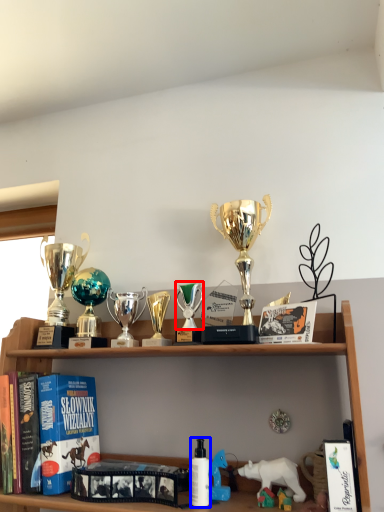
Question: Which object is closer to the camera taking this photo, toy (highlighted by a red box) or toiletry (highlighted by a blue box)?

Choices:
 (A) toy
 (B) toiletry

Answer: (B)